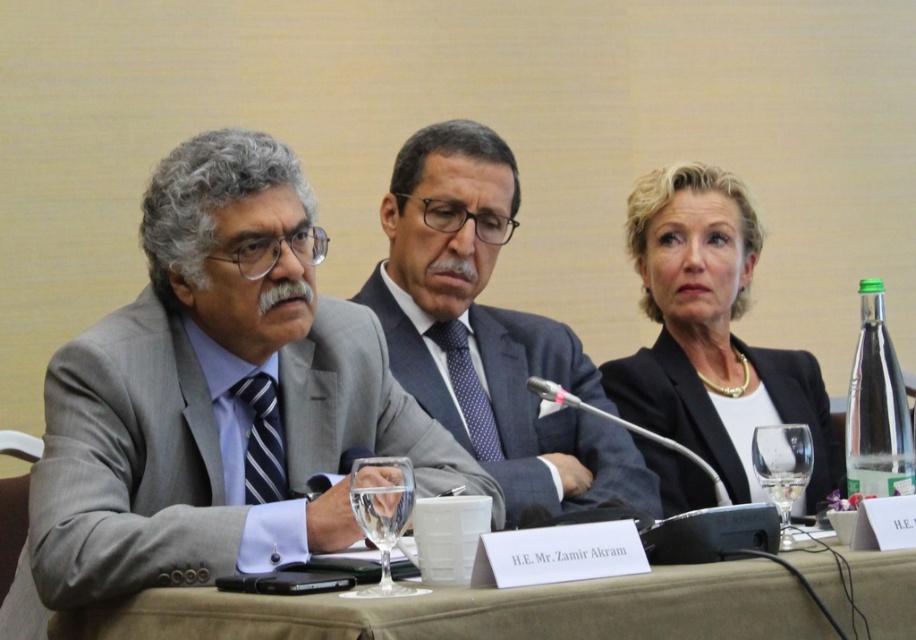
Who is more distant from viewer, (184,305) or (869,428)?

Positioned behind is point (184,305).

Who is taller, gray suit at center or green glass bottle at right?

Standing taller between the two is gray suit at center.

Between point (229, 360) and point (845, 416), which one is positioned in front?

Point (229, 360) is more forward.

What are the coordinates of `gray suit at center` in the screenshot? It's located at (214, 400).

From the picture: Can you confirm if black leather jacket at upper center is positioned above clear glass wine glass at right?

Yes, black leather jacket at upper center is above clear glass wine glass at right.

Who is taller, black leather jacket at upper center or clear glass wine glass at right?

black leather jacket at upper center is taller.

Is point (704, 387) farther from camera compared to point (789, 499)?

Yes, it is behind point (789, 499).

At what (x,y) coordinates should I click in order to perform the action: click on black leather jacket at upper center. Please return your answer as a coordinate pair (x, y). Looking at the image, I should click on (712, 336).

Who is lower down, matte black suit at center or clear glass wine glass at center?

clear glass wine glass at center

Where is `matte black suit at center`? The height and width of the screenshot is (640, 916). matte black suit at center is located at coordinates (488, 332).

Image resolution: width=916 pixels, height=640 pixels. I want to click on matte black suit at center, so click(488, 332).